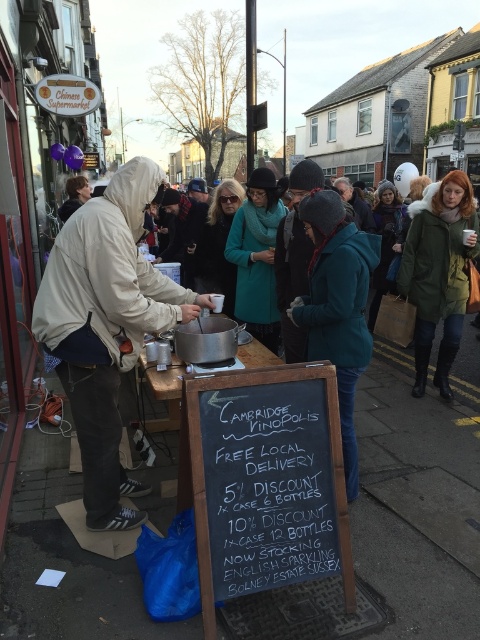
From the picture: You are a customer at the Cambridge market and want to read the chalkboard advertisement. However, you are wearing a white fleece jacket at center. Can you move your jacket to see the black chalkboard at center better?

The black chalkboard at center is positioned under the white fleece jacket at center, so moving the jacket out of the way would allow you to see the chalkboard advertisement clearly.

Based on the photo, you are a customer at the Cambridge market stall. You see the black chalkboard at center and the white fleece jacket at center. Which item is shorter in height?

The black chalkboard at center has a lesser height compared to the white fleece jacket at center, so the black chalkboard at center is shorter.